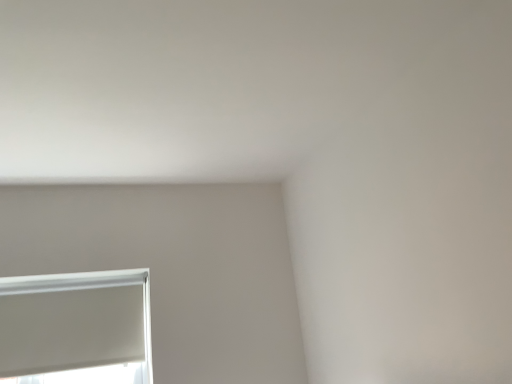
Question: Should I look upward or downward to see white matte window at lower left?

Choices:
 (A) down
 (B) up

Answer: (A)